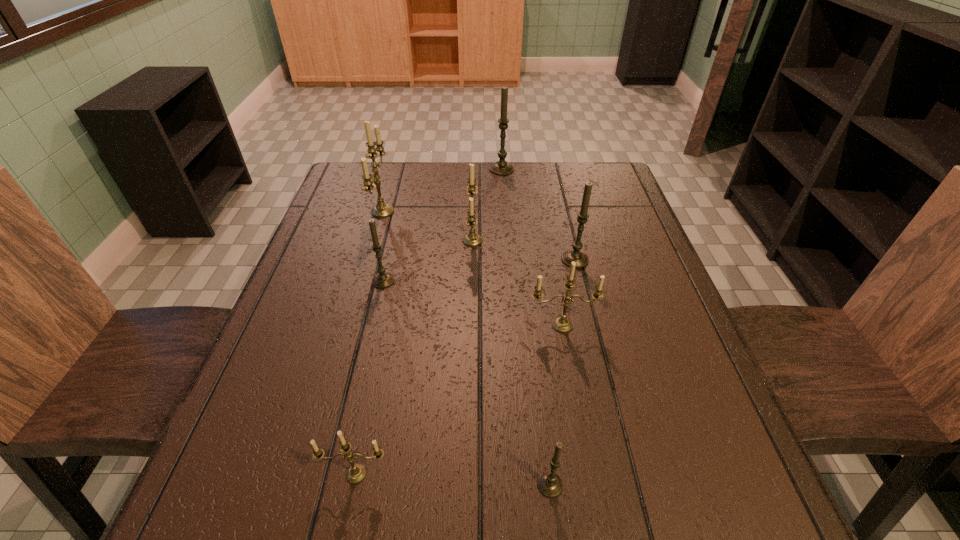
Where is `the third biggest metallic candle`? Image resolution: width=960 pixels, height=540 pixels. the third biggest metallic candle is located at coordinates tap(561, 324).

The width and height of the screenshot is (960, 540). I want to click on the smallest gray candle, so click(549, 483).

Image resolution: width=960 pixels, height=540 pixels. In order to click on the smallest metallic candle in this screenshot , I will do `click(356, 473)`.

Locate an element on the screen. vacant space situated on the front of the farthest gray candle is located at coordinates (504, 202).

You are a GUI agent. You are given a task and a screenshot of the screen. Output one action in this format:
    pyautogui.click(x=<x>, y=<y>)
    Task: Click on the free space located 0.260m on the right of the biggest metallic candle
    The image size is (960, 540).
    Given the screenshot: What is the action you would take?
    pyautogui.click(x=485, y=212)

I want to click on vacant region located on the left of the second farthest gray candle, so click(x=510, y=259).

Where is `vacant space located on the back of the third smallest metallic candle`? vacant space located on the back of the third smallest metallic candle is located at coordinates (473, 206).

Locate an element on the screen. This screenshot has height=540, width=960. vacant space located on the front of the leftmost gray candle is located at coordinates (360, 383).

This screenshot has height=540, width=960. I want to click on vacant space located 0.390m on the front of the third biggest metallic candle, so click(600, 537).

Where is `vacant position located on the back of the nearest gray candle`? vacant position located on the back of the nearest gray candle is located at coordinates (545, 442).